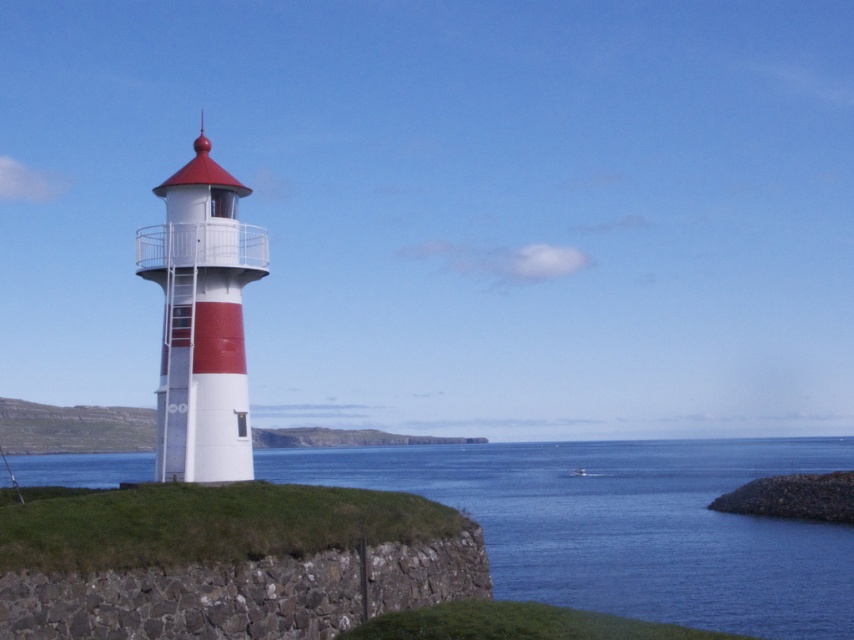
You are standing at the lighthouse and looking towards the point marked at coordinates point (x=627, y=524). Which direction should you face to see the blue water at lower left?

The point (x=627, y=524) is on blue water at lower left, so you should face towards the lower left direction to see the blue water at lower left.

You are standing on the grassy slope near the smooth white lighthouse at left and want to walk to the blue water at lower left. Which direction should you move relative to the lighthouse?

The smooth white lighthouse at left is behind blue water at lower left, so to reach the blue water at lower left, you should move away from the lighthouse towards the lower left direction.

You are standing at the base of the lighthouse and want to reach the rocky cliffs. Based on the scene, which direction should you walk to get closer to the dark gray stone cliff at lower left without getting into the blue water at lower left?

You should walk away from the blue water at lower left because the dark gray stone cliff at lower left is further away from you than the blue water at lower left.